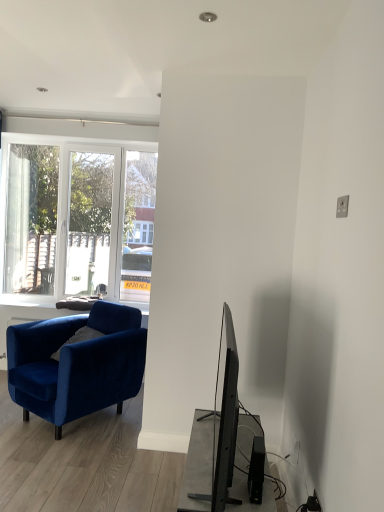
The height and width of the screenshot is (512, 384). Describe the element at coordinates (77, 362) in the screenshot. I see `velvet blue armchair at left` at that location.

The image size is (384, 512). Identify the location of velvet blue armchair at left. pyautogui.click(x=77, y=362).

In order to face black plastic speaker at lower right, should I rotate leftwards or rightwards?

Turn right approximately 8.723 degrees to face it.

The height and width of the screenshot is (512, 384). What are the coordinates of `black plastic speaker at lower right` in the screenshot? It's located at (256, 470).

The width and height of the screenshot is (384, 512). What do you see at coordinates (256, 470) in the screenshot?
I see `black plastic speaker at lower right` at bounding box center [256, 470].

Where is `velvet blue armchair at left`? velvet blue armchair at left is located at coordinates (77, 362).

Is velvet blue armchair at left at the right side of black plastic speaker at lower right?

In fact, velvet blue armchair at left is to the left of black plastic speaker at lower right.

In the image, is velvet blue armchair at left positioned in front of or behind black plastic speaker at lower right?

Clearly, velvet blue armchair at left is behind black plastic speaker at lower right.

Which point is more distant from viewer, (x=97, y=347) or (x=255, y=485)?

Point (x=97, y=347)

From the image's perspective, is velvet blue armchair at left positioned above or below black plastic speaker at lower right?

Based on their image positions, velvet blue armchair at left is located above black plastic speaker at lower right.

From a real-world perspective, is velvet blue armchair at left above or below black plastic speaker at lower right?

From a real-world perspective, velvet blue armchair at left is physically below black plastic speaker at lower right.

Does velvet blue armchair at left have a lesser width compared to black plastic speaker at lower right?

No.

Between velvet blue armchair at left and black plastic speaker at lower right, which one has less height?

With less height is black plastic speaker at lower right.

Consider the image. Who is smaller, velvet blue armchair at left or black plastic speaker at lower right?

With smaller size is black plastic speaker at lower right.

Is velvet blue armchair at left inside the boundaries of black plastic speaker at lower right, or outside?

velvet blue armchair at left is outside black plastic speaker at lower right.

Would you consider velvet blue armchair at left to be distant from black plastic speaker at lower right?

Yes, velvet blue armchair at left and black plastic speaker at lower right are quite far apart.

Could you tell me if velvet blue armchair at left is turned towards black plastic speaker at lower right?

No, velvet blue armchair at left is not turned towards black plastic speaker at lower right.

Image resolution: width=384 pixels, height=512 pixels. I want to click on speaker lying on the right of velvet blue armchair at left, so click(256, 470).

Visually, is black plastic speaker at lower right positioned to the left or to the right of velvet blue armchair at left?

Based on their positions, black plastic speaker at lower right is located to the right of velvet blue armchair at left.

Between black plastic speaker at lower right and velvet blue armchair at left, which one is positioned in front?

Positioned in front is black plastic speaker at lower right.

Which is closer, (261, 485) or (129, 387)?

Point (261, 485) appears to be closer to the viewer than point (129, 387).

Consider the image. From the image's perspective, which object appears higher, black plastic speaker at lower right or velvet blue armchair at left?

From the image's view, velvet blue armchair at left is above.

From a real-world perspective, relative to velvet blue armchair at left, is black plastic speaker at lower right vertically above or below?

From a real-world perspective, black plastic speaker at lower right is physically above velvet blue armchair at left.

Between black plastic speaker at lower right and velvet blue armchair at left, which one has larger width?

velvet blue armchair at left is wider.

In terms of height, does black plastic speaker at lower right look taller or shorter compared to velvet blue armchair at left?

In the image, black plastic speaker at lower right appears to be shorter than velvet blue armchair at left.

Is black plastic speaker at lower right bigger or smaller than velvet blue armchair at left?

Clearly, black plastic speaker at lower right is smaller in size than velvet blue armchair at left.

Consider the image. Is velvet blue armchair at left completely or partially inside black plastic speaker at lower right?

No, velvet blue armchair at left is not surrounded by black plastic speaker at lower right.

Is black plastic speaker at lower right in contact with velvet blue armchair at left?

black plastic speaker at lower right and velvet blue armchair at left are clearly separated.

Is black plastic speaker at lower right oriented away from velvet blue armchair at left?

No, black plastic speaker at lower right's orientation is not away from velvet blue armchair at left.

How different are the orientations of black plastic speaker at lower right and velvet blue armchair at left in degrees?

black plastic speaker at lower right and velvet blue armchair at left are facing 63 degrees away from each other.

Measure the distance between black plastic speaker at lower right and velvet blue armchair at left.

1.60 meters.

At what (x,y) coordinates should I click in order to perform the action: click on chair on the left of black plastic speaker at lower right. Please return your answer as a coordinate pair (x, y). The image size is (384, 512). Looking at the image, I should click on (77, 362).

Identify the location of chair behind the black plastic speaker at lower right. Image resolution: width=384 pixels, height=512 pixels. (77, 362).

Locate an element on the screen. The height and width of the screenshot is (512, 384). speaker below the velvet blue armchair at left (from the image's perspective) is located at coordinates (256, 470).